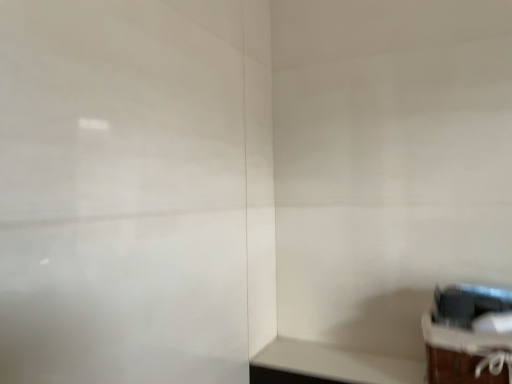
Question: Is wooden crate at lower right bigger or smaller than white matte table at lower right?

Choices:
 (A) small
 (B) big

Answer: (B)

Question: In the image, is wooden crate at lower right positioned in front of or behind white matte table at lower right?

Choices:
 (A) behind
 (B) front

Answer: (B)

Question: Based on their positions, is wooden crate at lower right located to the left or right of white matte table at lower right?

Choices:
 (A) left
 (B) right

Answer: (B)

Question: Is white matte table at lower right bigger or smaller than wooden crate at lower right?

Choices:
 (A) small
 (B) big

Answer: (A)

Question: Considering the positions of white matte table at lower right and wooden crate at lower right in the image, is white matte table at lower right wider or thinner than wooden crate at lower right?

Choices:
 (A) thin
 (B) wide

Answer: (A)

Question: In the image, is white matte table at lower right on the left side or the right side of wooden crate at lower right?

Choices:
 (A) left
 (B) right

Answer: (A)

Question: From the image's perspective, relative to wooden crate at lower right, is white matte table at lower right above or below?

Choices:
 (A) above
 (B) below

Answer: (B)